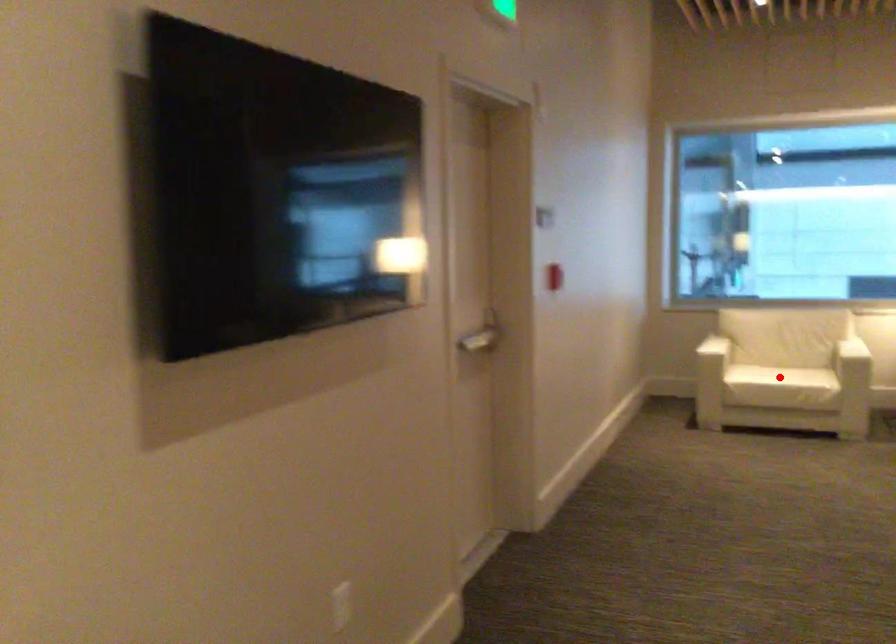
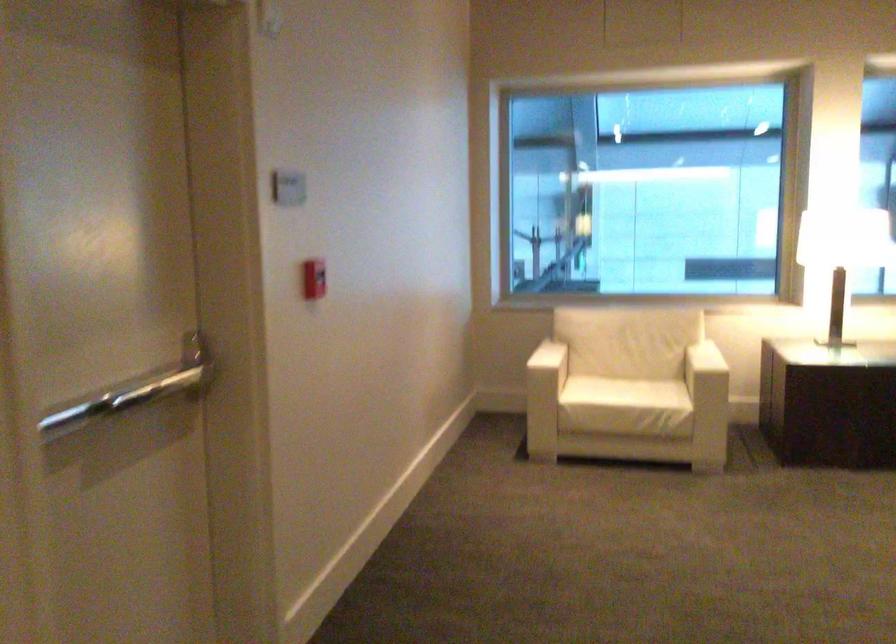
Find the pixel in the second image that matches the highlighted location in the first image.

(614, 413)